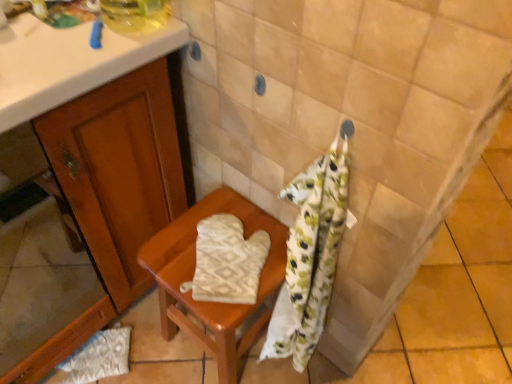
Question: Can you confirm if beige textured oven mitt at center is bigger than beige fabric oven mitt at center?

Choices:
 (A) yes
 (B) no

Answer: (B)

Question: Considering the relative positions of beige textured oven mitt at center and beige fabric oven mitt at center in the image provided, is beige textured oven mitt at center to the right of beige fabric oven mitt at center from the viewer's perspective?

Choices:
 (A) no
 (B) yes

Answer: (B)

Question: From a real-world perspective, is beige textured oven mitt at center physically above beige fabric oven mitt at center?

Choices:
 (A) yes
 (B) no

Answer: (A)

Question: Can you confirm if beige textured oven mitt at center is positioned to the left of beige fabric oven mitt at center?

Choices:
 (A) no
 (B) yes

Answer: (A)

Question: From the image's perspective, is beige textured oven mitt at center located above beige fabric oven mitt at center?

Choices:
 (A) yes
 (B) no

Answer: (A)

Question: Is beige fabric oven mitt at center taller or shorter than white textured oven mitt at lower left?

Choices:
 (A) tall
 (B) short

Answer: (A)

Question: Based on their positions, is beige fabric oven mitt at center located to the left or right of white textured oven mitt at lower left?

Choices:
 (A) right
 (B) left

Answer: (A)

Question: Is beige fabric oven mitt at center spatially inside white textured oven mitt at lower left, or outside of it?

Choices:
 (A) outside
 (B) inside

Answer: (A)

Question: Considering the positions of point (247, 205) and point (79, 375), is point (247, 205) closer or farther from the camera than point (79, 375)?

Choices:
 (A) closer
 (B) farther

Answer: (A)

Question: Relative to beige fabric oven mitt at center, is white textured oven mitt at lower left in front or behind?

Choices:
 (A) front
 (B) behind

Answer: (B)

Question: From the image's perspective, relative to beige fabric oven mitt at center, is white textured oven mitt at lower left above or below?

Choices:
 (A) above
 (B) below

Answer: (B)

Question: Considering the positions of white textured oven mitt at lower left and beige fabric oven mitt at center in the image, is white textured oven mitt at lower left taller or shorter than beige fabric oven mitt at center?

Choices:
 (A) short
 (B) tall

Answer: (A)

Question: From a real-world perspective, is white textured oven mitt at lower left physically located above or below beige fabric oven mitt at center?

Choices:
 (A) above
 (B) below

Answer: (B)

Question: Considering the positions of beige fabric oven mitt at center and beige textured oven mitt at center in the image, is beige fabric oven mitt at center taller or shorter than beige textured oven mitt at center?

Choices:
 (A) tall
 (B) short

Answer: (A)

Question: Is beige fabric oven mitt at center spatially inside beige textured oven mitt at center, or outside of it?

Choices:
 (A) outside
 (B) inside

Answer: (A)